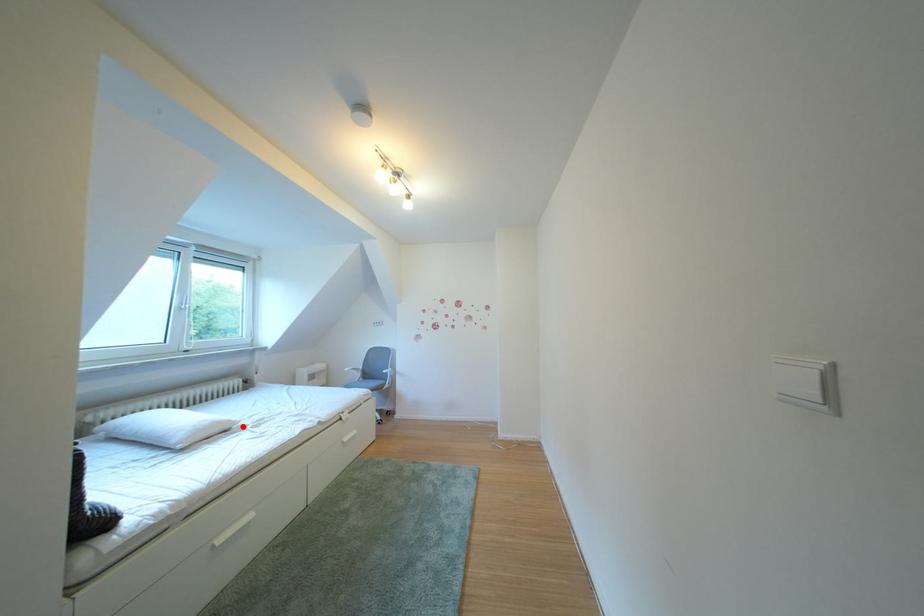
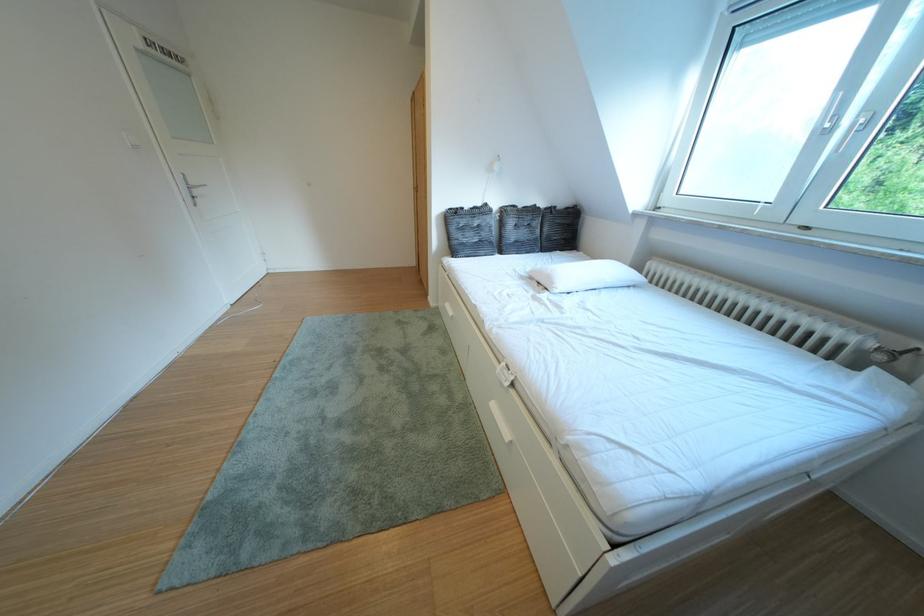
In the second image, find the point that corresponds to the highlighted location in the first image.

(565, 288)